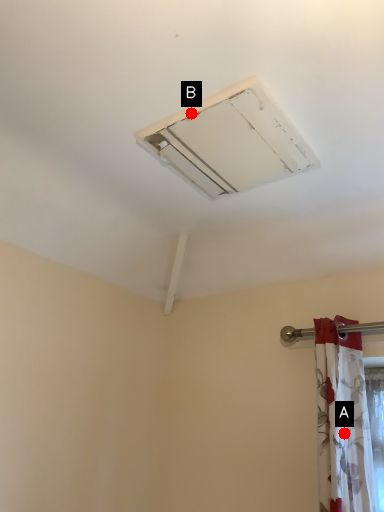
Question: Two points are circled on the image, labeled by A and B beside each circle. Which point is farther to the camera?

Choices:
 (A) A is further
 (B) B is further

Answer: (A)